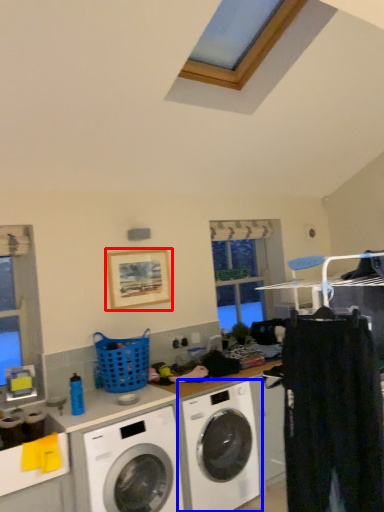
Question: Among these objects, which one is nearest to the camera, picture frame (highlighted by a red box) or washing machine (highlighted by a blue box)?

Choices:
 (A) picture frame
 (B) washing machine

Answer: (B)